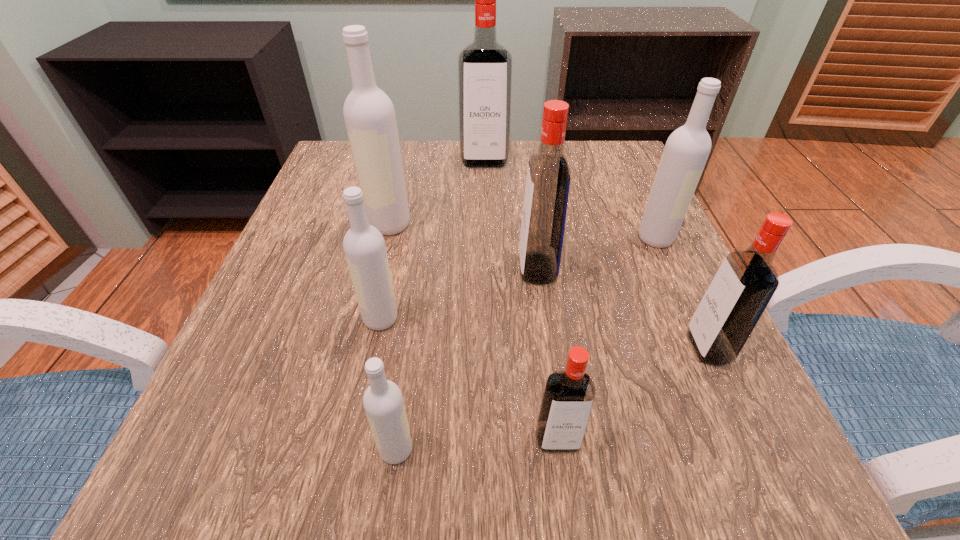
The width and height of the screenshot is (960, 540). Find the location of `blank area located on the front and back of the second nearest red vodka`. blank area located on the front and back of the second nearest red vodka is located at coordinates (479, 347).

Identify the location of free space located on the front and back of the second nearest red vodka. The height and width of the screenshot is (540, 960). (492, 347).

This screenshot has width=960, height=540. I want to click on vacant space located 0.060m on the front and back of the nearest red vodka, so click(x=566, y=506).

Locate an element on the screen. free region located on the right of the second white vodka from right to left is located at coordinates (461, 449).

Identify the location of object located in the far edge section of the desktop. (484, 67).

The height and width of the screenshot is (540, 960). Identify the location of object that is positioned at the left edge. (369, 114).

The image size is (960, 540). In order to click on free point at the far edge in this screenshot , I will do `click(420, 173)`.

Locate an element on the screen. Image resolution: width=960 pixels, height=540 pixels. vacant area at the near edge of the desktop is located at coordinates (388, 506).

Where is `free space at the left edge`? Image resolution: width=960 pixels, height=540 pixels. free space at the left edge is located at coordinates (307, 431).

Where is `vacant space at the right edge`? vacant space at the right edge is located at coordinates (625, 265).